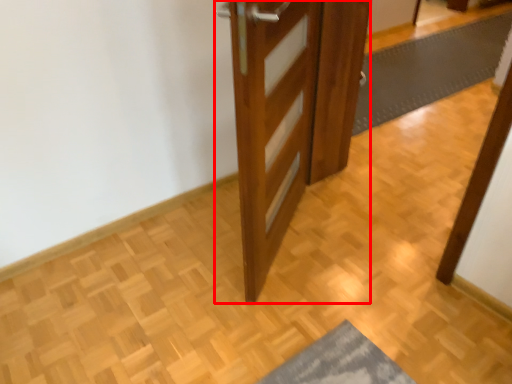
Question: From the image, what is the correct spatial relationship of door (annotated by the red box) in relation to bath mat?

Choices:
 (A) left
 (B) right

Answer: (A)